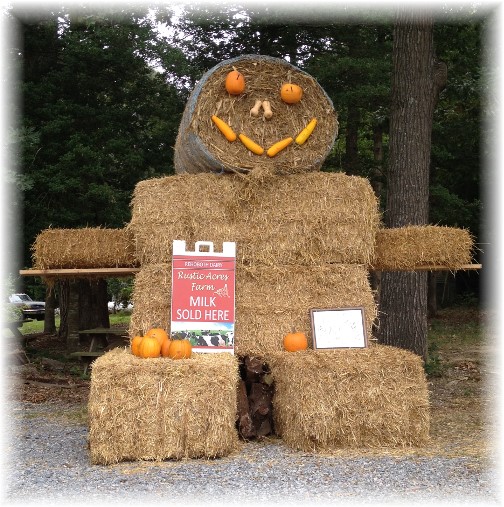
Image resolution: width=504 pixels, height=507 pixels. In order to click on frame picture in this screenshot , I will do `click(340, 316)`.